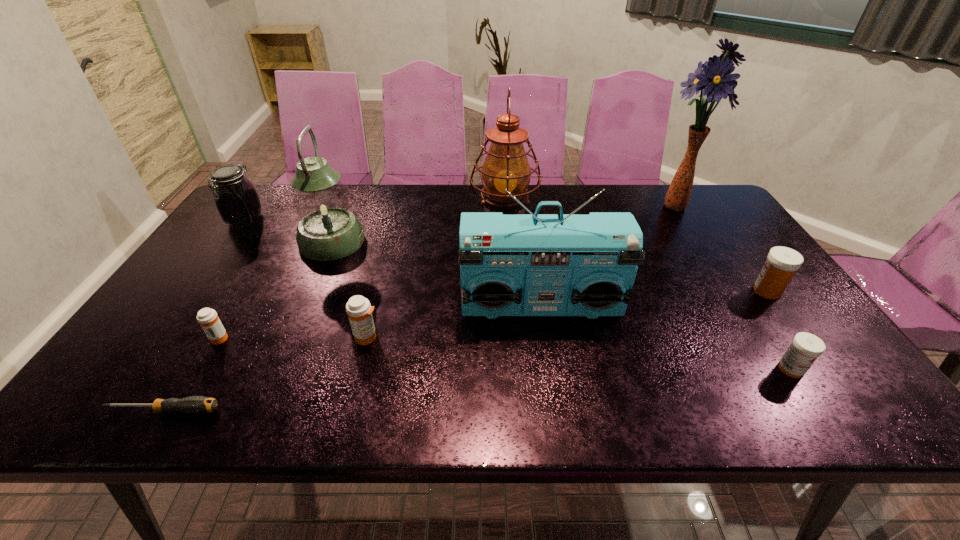
The image size is (960, 540). Find the location of `purple flower arrangement`. purple flower arrangement is located at coordinates (715, 79).

I want to click on flower arrangement, so click(715, 79).

Where is `oil lamp`? oil lamp is located at coordinates (506, 166).

Locate an element on the screen. Image resolution: width=960 pixels, height=540 pixels. greenish lantern is located at coordinates (327, 230).

Where is `radio receiver`? radio receiver is located at coordinates point(510,265).

This screenshot has width=960, height=540. I want to click on the fifth tallest object, so click(236, 199).

The height and width of the screenshot is (540, 960). I want to click on the right white medicine, so click(782, 262).

Locate an element on the screen. This screenshot has width=960, height=540. the farthest medicine is located at coordinates (782, 262).

Find the location of a particular element. The image size is (960, 540). the fifth object from left to right is located at coordinates (358, 308).

Where is `the bigger orange medicine`? the bigger orange medicine is located at coordinates coord(358,308).